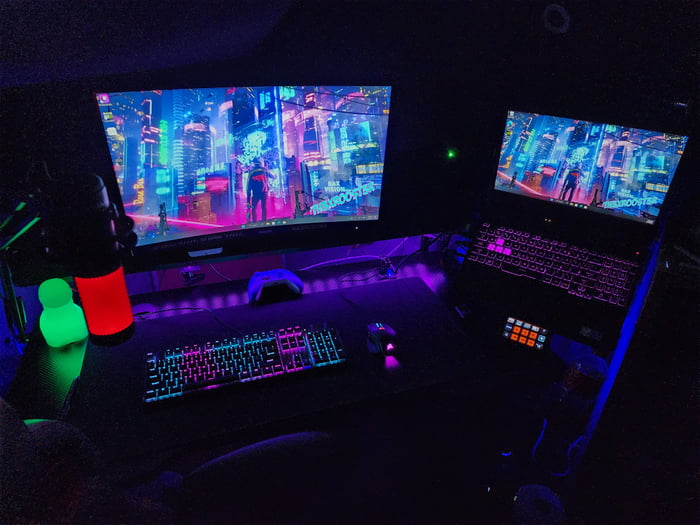
You are a GUI agent. You are given a task and a screenshot of the screen. Output one action in this format:
    pyautogui.click(x=<x>, y=<y>)
    Task: Click on the bottle
    The width and height of the screenshot is (700, 525).
    Given the screenshot: What is the action you would take?
    pyautogui.click(x=102, y=262)